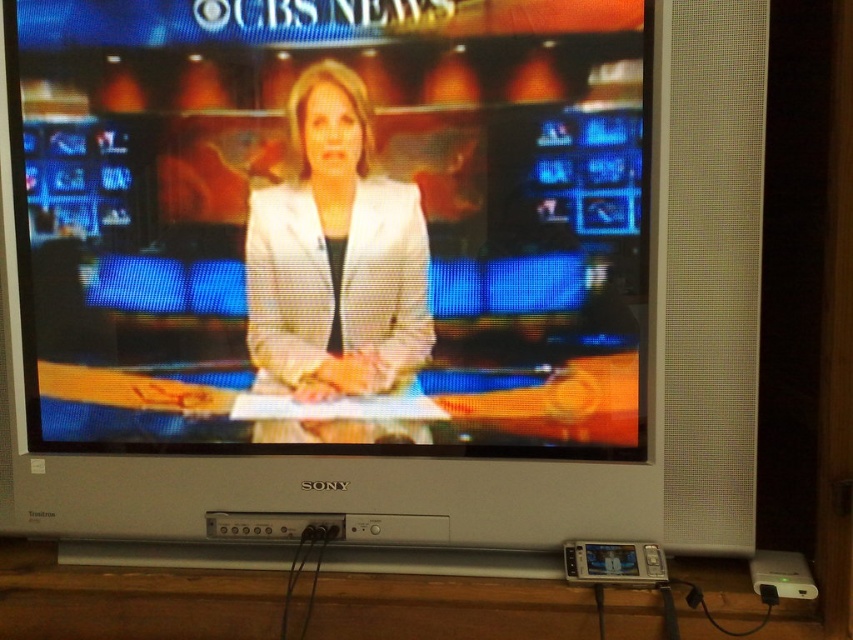
Is matte white suit at center wider than white matte blazer at center?

Yes, matte white suit at center is wider than white matte blazer at center.

Can you confirm if matte white suit at center is positioned below white matte blazer at center?

No, matte white suit at center is not below white matte blazer at center.

Which is behind, point (74, 321) or point (392, 237)?

The point (74, 321) is more distant.

The height and width of the screenshot is (640, 853). What are the coordinates of `matte white suit at center` in the screenshot? It's located at (329, 220).